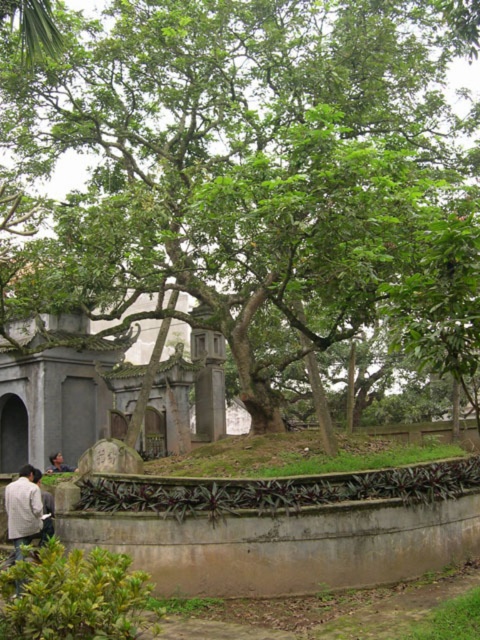
Question: Does green leafy tree at center appear on the left side of light brown leather jacket at lower left?

Choices:
 (A) no
 (B) yes

Answer: (A)

Question: Does green leafy tree at center appear on the left side of white cotton shirt at lower left?

Choices:
 (A) no
 (B) yes

Answer: (A)

Question: Which object is closer to the camera taking this photo?

Choices:
 (A) light brown leather jacket at lower left
 (B) green leafy tree at center

Answer: (B)

Question: Does light brown leather jacket at lower left have a greater width compared to light brown wooden head at center?

Choices:
 (A) yes
 (B) no

Answer: (A)

Question: Which object is positioned farthest from the green leafy tree at center?

Choices:
 (A) white cotton shirt at lower left
 (B) light brown wooden head at center
 (C) light brown leather jacket at lower left

Answer: (A)

Question: Which point is closer to the camera taking this photo?

Choices:
 (A) (388, 144)
 (B) (58, 468)
 (C) (48, 531)
 (D) (33, 484)

Answer: (D)